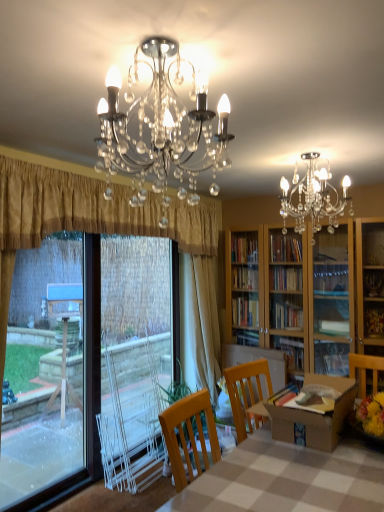
Where is `free space above clear crystal chandelier at upper center (from a real-world perspective)`? The width and height of the screenshot is (384, 512). free space above clear crystal chandelier at upper center (from a real-world perspective) is located at coordinates (154, 33).